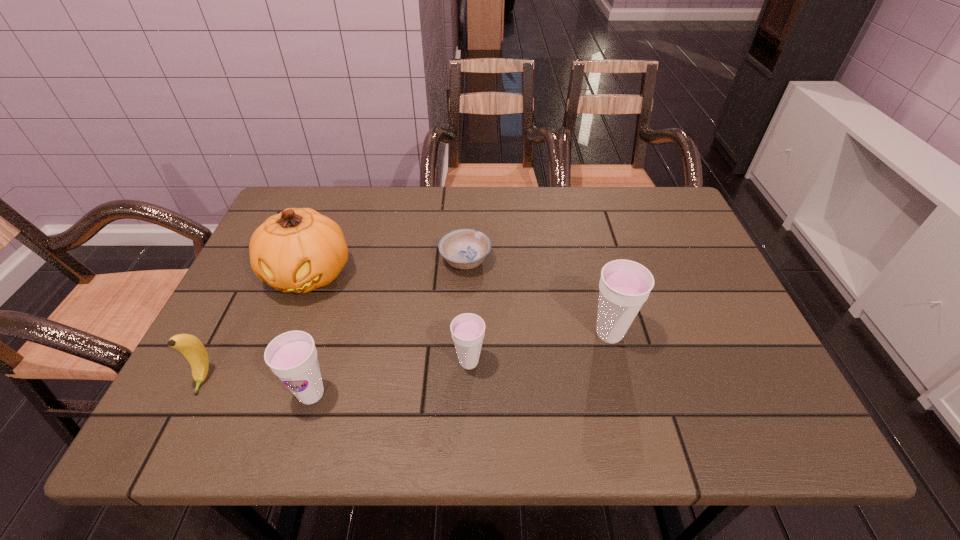
At what (x,y) coordinates should I click in order to perform the action: click on the leftmost cup. Please return your answer as a coordinate pair (x, y). This screenshot has height=540, width=960. Looking at the image, I should click on click(x=292, y=356).

Identify the location of the second cup from right to left. (467, 330).

The width and height of the screenshot is (960, 540). Identify the location of the rightmost object. (625, 285).

You are a GUI agent. You are given a task and a screenshot of the screen. Output one action in this format:
    pyautogui.click(x=<x>, y=<y>)
    Task: Click on the tallest cup
    The image size is (960, 540).
    Given the screenshot: What is the action you would take?
    pyautogui.click(x=625, y=285)

Where is `pumpkin`? The image size is (960, 540). pumpkin is located at coordinates (298, 250).

The width and height of the screenshot is (960, 540). Find the location of `the shortest object`. the shortest object is located at coordinates (465, 248).

Where is `the leftmost object`? The height and width of the screenshot is (540, 960). the leftmost object is located at coordinates (191, 347).

Locate an element on the screen. Image resolution: width=960 pixels, height=540 pixels. free space located 0.060m on the right of the leftmost cup is located at coordinates (363, 394).

At what (x,y) coordinates should I click in order to perform the action: click on free space located on the right of the second cup from left to right. Please return your answer as a coordinate pair (x, y). Looking at the image, I should click on (561, 362).

Find the location of a particular element. This screenshot has height=540, width=960. vacant region located on the left of the second tallest object is located at coordinates (457, 334).